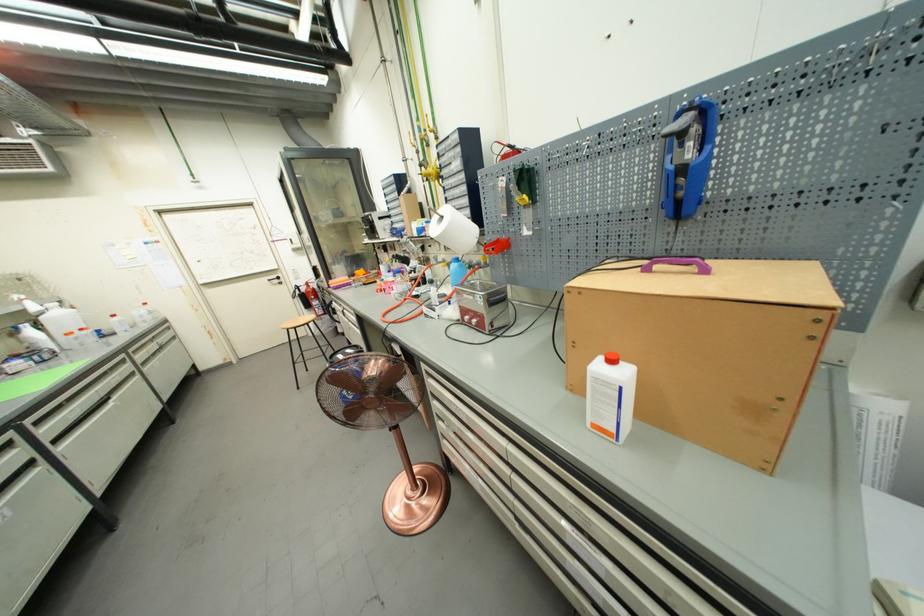
Where is `purple box handle`? purple box handle is located at coordinates (677, 264).